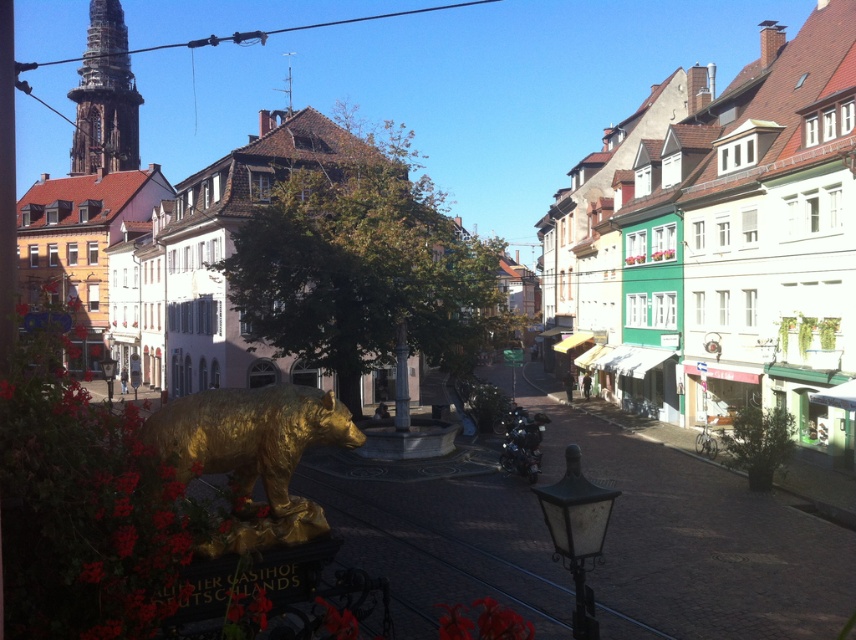
Is point (280, 481) positioned in front of point (117, 24)?

Yes.

Does point (289, 477) lie behind point (116, 115)?

That is False.

Where is `gold metallic bear at center`? This screenshot has height=640, width=856. gold metallic bear at center is located at coordinates 248,435.